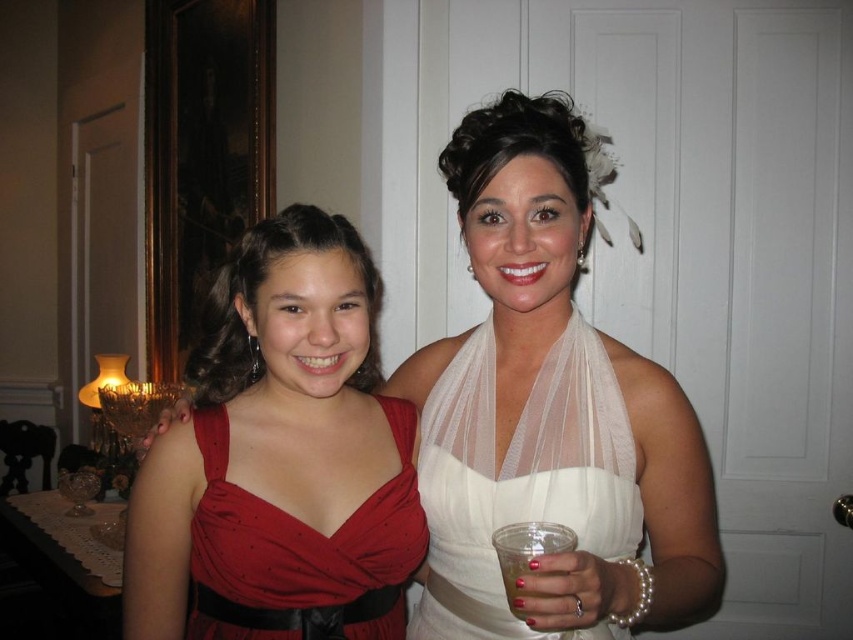
You are planning to take a photo of the two people in the image. The photographer mentioned that the white sheer veil at center and the shiny satin dress at center are both in the frame. Considering their sizes, which one is more likely to be noticed first by the viewer?

The white sheer veil at center has a larger size compared to the shiny satin dress at center, so it is more likely to be noticed first by the viewer due to its larger size.

You are at a party and want to take a photo with the white sheer dress at center and the clear plastic cup at lower center in the frame. Which object should you focus on first to ensure both are in focus?

The white sheer dress at center is much taller than the clear plastic cup at lower center, so focusing on the white sheer dress at center first will help ensure both are in focus.